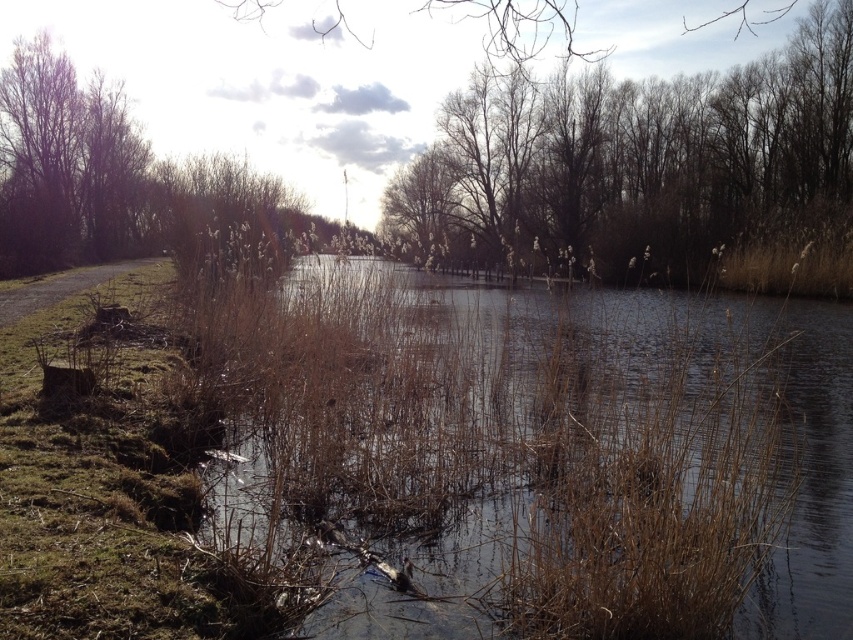
Question: From the image, what is the correct spatial relationship of bare branches at upper center in relation to brown bare branches at upper left?

Choices:
 (A) right
 (B) left

Answer: (A)

Question: Which object is closer to the camera taking this photo?

Choices:
 (A) bare branches at upper center
 (B) brown bare branches at upper left

Answer: (A)

Question: Which of the following is the closest to the observer?

Choices:
 (A) (785, 45)
 (B) (93, 116)

Answer: (B)

Question: Is bare branches at upper center above brown bare branches at upper left?

Choices:
 (A) yes
 (B) no

Answer: (B)

Question: Is bare branches at upper center above brown bare branches at upper left?

Choices:
 (A) no
 (B) yes

Answer: (A)